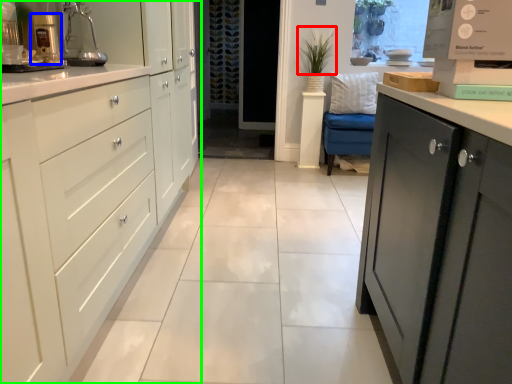
Question: Which object is the closest to the plant (highlighted by a red box)? Choose among these: coffee machine (highlighted by a blue box) or cabinetry (highlighted by a green box).

Choices:
 (A) coffee machine
 (B) cabinetry

Answer: (B)